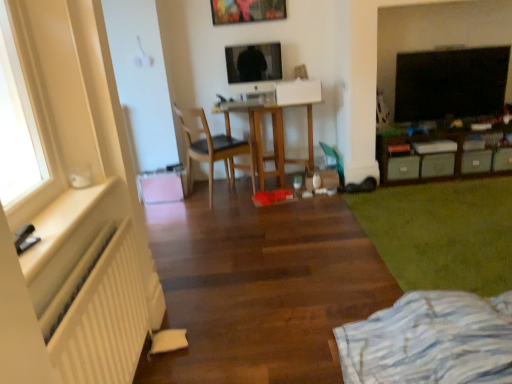
Question: From the image's perspective, does green matte storage unit at right appear higher than gray matte drawer at lower right, which is counted as the third drawer, starting from the right?

Choices:
 (A) no
 (B) yes

Answer: (B)

Question: Is green matte storage unit at right smaller than gray matte drawer at lower right, which ranks as the 2th drawer in left-to-right order?

Choices:
 (A) yes
 (B) no

Answer: (B)

Question: Is green matte storage unit at right at the right side of gray matte drawer at lower right, which is counted as the third drawer, starting from the right?

Choices:
 (A) yes
 (B) no

Answer: (A)

Question: Is gray matte drawer at lower right, which ranks as the 2th drawer in left-to-right order, surrounded by green matte storage unit at right?

Choices:
 (A) no
 (B) yes

Answer: (B)

Question: Considering the relative sizes of green matte storage unit at right and gray matte drawer at lower right, which ranks as the 2th drawer in left-to-right order, in the image provided, is green matte storage unit at right shorter than gray matte drawer at lower right, which ranks as the 2th drawer in left-to-right order,?

Choices:
 (A) yes
 (B) no

Answer: (B)

Question: Is green matte storage unit at right looking in the opposite direction of gray matte drawer at lower right, which is counted as the third drawer, starting from the right?

Choices:
 (A) yes
 (B) no

Answer: (A)

Question: From the image's perspective, would you say green matte drawer at right, which is counted as the 1th drawer, starting from the left, is shown under white matte radiator at left?

Choices:
 (A) yes
 (B) no

Answer: (A)

Question: Considering the relative sizes of green matte drawer at right, which is counted as the 1th drawer, starting from the left, and white matte radiator at left in the image provided, is green matte drawer at right, which is counted as the 1th drawer, starting from the left, smaller than white matte radiator at left?

Choices:
 (A) yes
 (B) no

Answer: (A)

Question: Is green matte drawer at right, which is counted as the 1th drawer, starting from the left, completely or partially outside of white matte radiator at left?

Choices:
 (A) no
 (B) yes

Answer: (B)

Question: Is green matte drawer at right, which is counted as the 1th drawer, starting from the left, not close to white matte radiator at left?

Choices:
 (A) no
 (B) yes

Answer: (B)

Question: Are green matte drawer at right, which is the 4th drawer from right to left, and white matte radiator at left beside each other?

Choices:
 (A) no
 (B) yes

Answer: (A)

Question: From the image's perspective, is green matte drawer at right, which is the 4th drawer from right to left, on white matte radiator at left?

Choices:
 (A) no
 (B) yes

Answer: (A)

Question: Is black glossy tv at upper right closer to the viewer compared to white matte radiator at left?

Choices:
 (A) yes
 (B) no

Answer: (B)